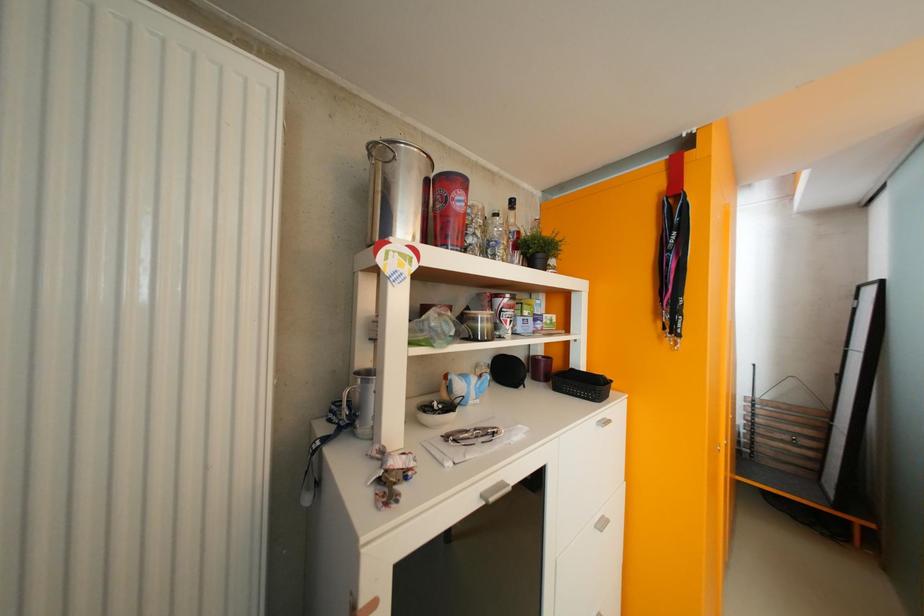
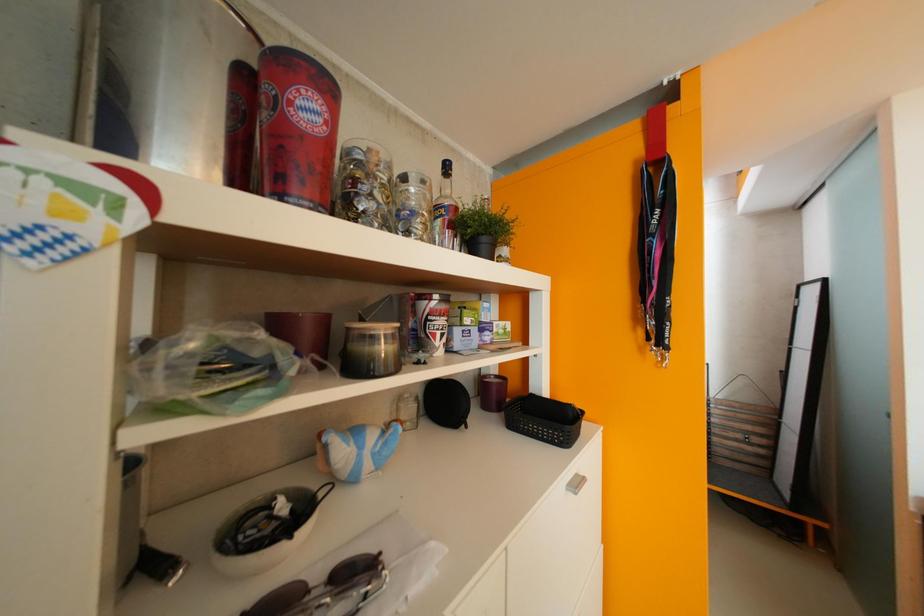
Question: The camera is either moving clockwise (left) or counter-clockwise (right) around the object. The first image is from the beginning of the video and the second image is from the end. Is the camera moving left or right when shooting the video?

Choices:
 (A) Left
 (B) Right

Answer: (A)